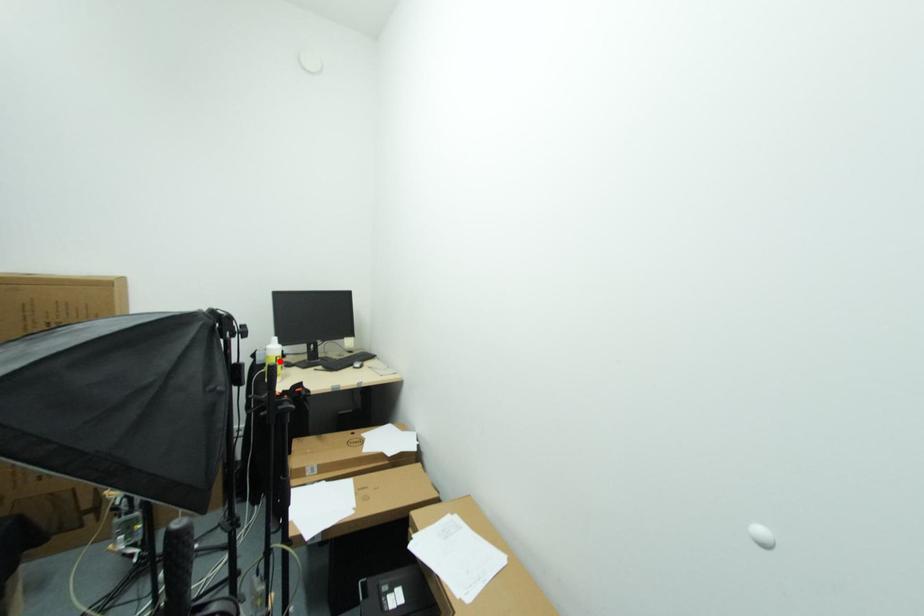
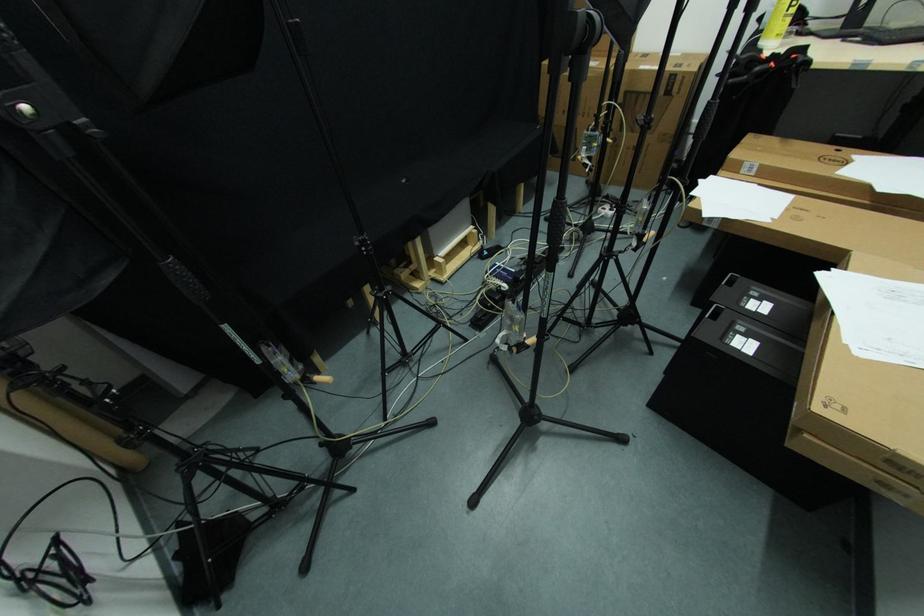
The point at the highlighted location is marked in the first image. Where is the corresponding point in the second image?

(796, 6)